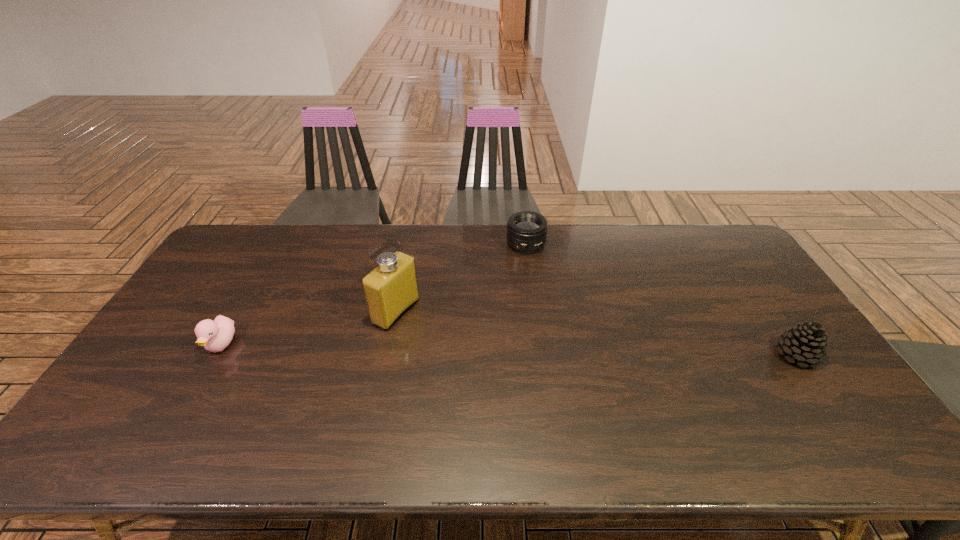
I want to click on object that is the nearest to the duckling, so click(x=390, y=289).

At what (x,y) coordinates should I click in order to perform the action: click on vacant space that satisfies the following two spatial constraints: 1. on the front-facing side of the duckling; 2. at the narrow end of the rightmost object. Please return your answer as a coordinate pair (x, y). The width and height of the screenshot is (960, 540). Looking at the image, I should click on (216, 355).

Locate an element on the screen. vacant area in the image that satisfies the following two spatial constraints: 1. on the front-facing side of the duckling; 2. at the narrow end of the rightmost object is located at coordinates coord(216,355).